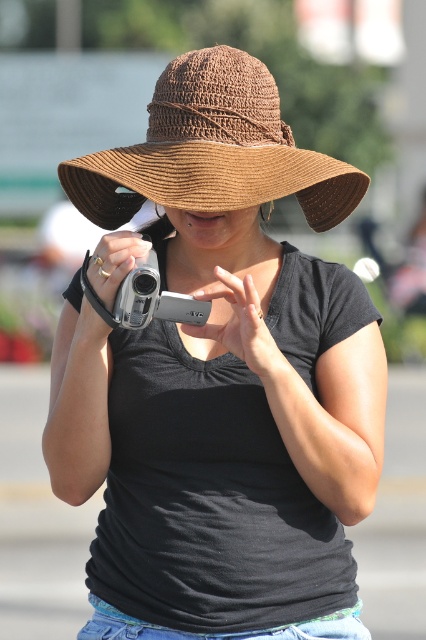
Is brown straw hat at center in front of silver metallic camera at center?

No, it is behind silver metallic camera at center.

Who is more distant from viewer, (166, 77) or (141, 285)?

The point (166, 77) is more distant.

You are a GUI agent. You are given a task and a screenshot of the screen. Output one action in this format:
    pyautogui.click(x=<x>, y=<y>)
    Task: Click on the brown straw hat at center
    The height and width of the screenshot is (640, 426).
    Given the screenshot: What is the action you would take?
    pyautogui.click(x=213, y=150)